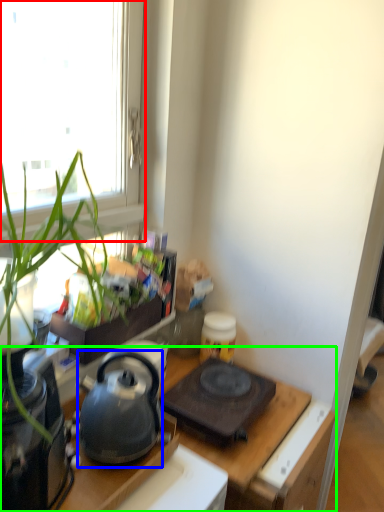
Question: Estimate the real-world distances between objects in this image. Which object is farther from window (highlighted by a red box), kettle (highlighted by a blue box) or desk (highlighted by a green box)?

Choices:
 (A) kettle
 (B) desk

Answer: (B)